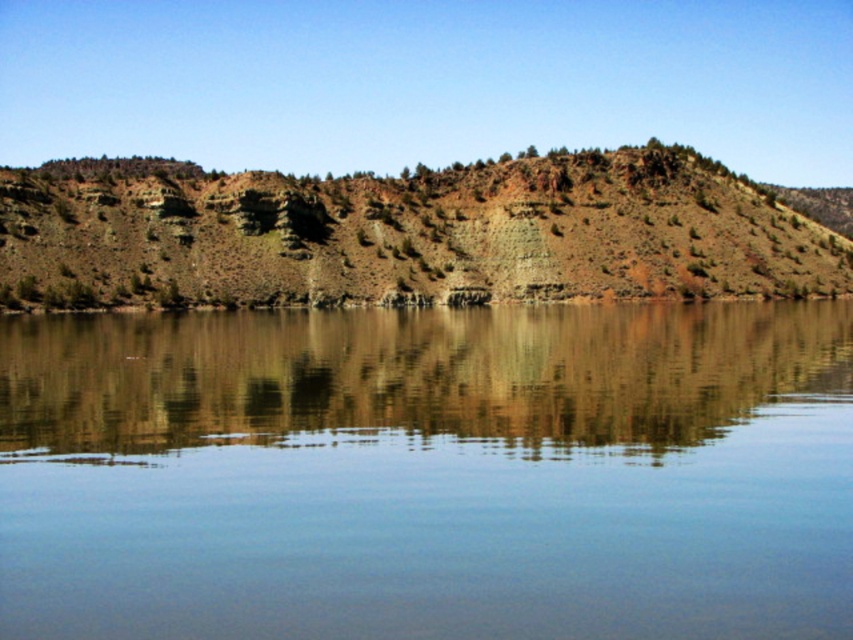
Question: Which is farther from the clear glass water at center?

Choices:
 (A) brown matte rock at center
 (B) rustic rock formation at center

Answer: (B)

Question: Can you confirm if clear glass water at center is positioned to the right of rustic rock formation at center?

Choices:
 (A) no
 (B) yes

Answer: (A)

Question: Is clear glass water at center below brown matte rock at center?

Choices:
 (A) no
 (B) yes

Answer: (B)

Question: Estimate the real-world distances between objects in this image. Which object is closer to the clear glass water at center?

Choices:
 (A) rustic rock formation at center
 (B) brown matte rock at center

Answer: (B)

Question: Which point is closer to the camera taking this photo?

Choices:
 (A) (45, 339)
 (B) (61, 218)

Answer: (A)

Question: Observing the image, what is the correct spatial positioning of clear glass water at center in reference to rustic rock formation at center?

Choices:
 (A) above
 (B) below

Answer: (B)